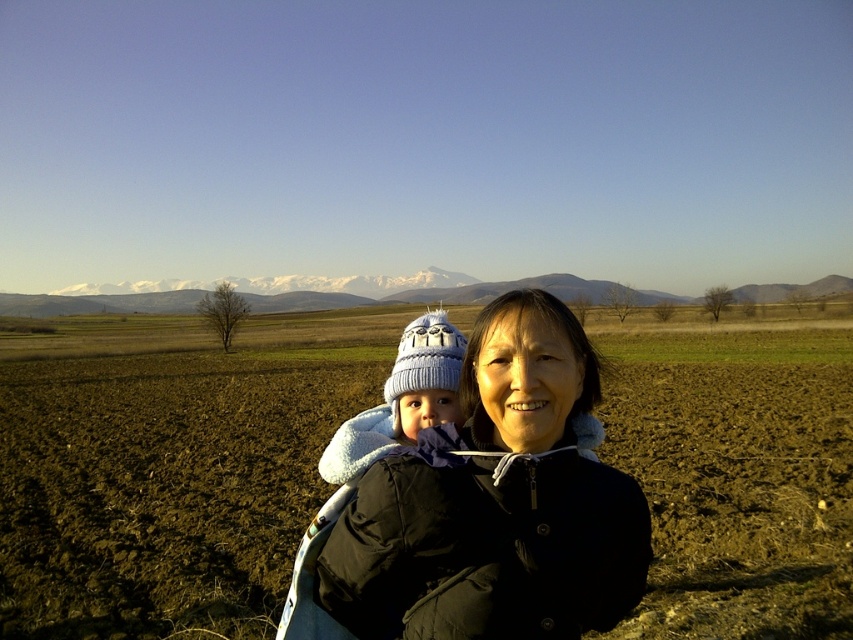
Question: Which object appears farthest from the camera in this image?

Choices:
 (A) brown soil at center
 (B) black fleece jacket at center

Answer: (A)

Question: Among these points, which one is nearest to the camera?

Choices:
 (A) pos(509,371)
 (B) pos(225,550)

Answer: (A)

Question: Is brown soil at center further to camera compared to black fleece jacket at center?

Choices:
 (A) no
 (B) yes

Answer: (B)

Question: Is brown soil at center to the right of black fleece jacket at center from the viewer's perspective?

Choices:
 (A) no
 (B) yes

Answer: (A)

Question: Can you confirm if brown soil at center is positioned to the right of black fleece jacket at center?

Choices:
 (A) yes
 (B) no

Answer: (B)